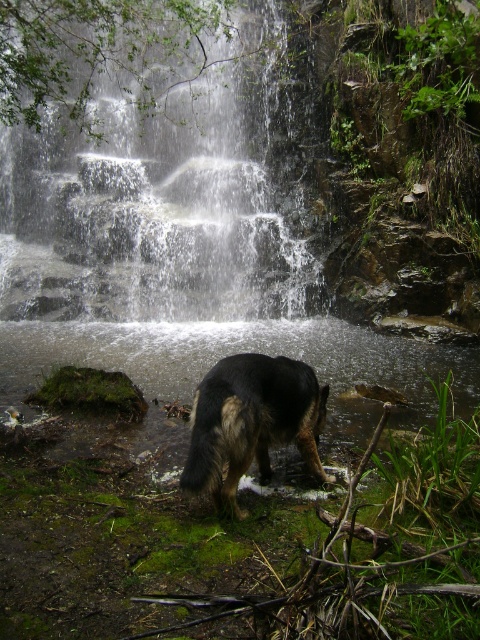
You are a photographer planning to take a picture of the white textured water at center and the dark brown fur dog at center. Which object should you focus on first if you want to capture both in the same frame without moving the camera? Explain your reasoning based on their sizes.

You should focus on the dark brown fur dog at center first because it is larger than the white textured water at center, ensuring it is in sharp focus while the smaller water area can still be captured within the frame.

You are a hiker who wants to cross the area where the white textured water at center and the dark brown fur dog at center are located. Is the path clear for you to walk there safely?

The white textured water at center is positioned over the dark brown fur dog at center, which means the water is above the dog. Since the dog is on the ground, the water might be flowing over the path, making it slippery or obstructed. It is not safe to walk there.